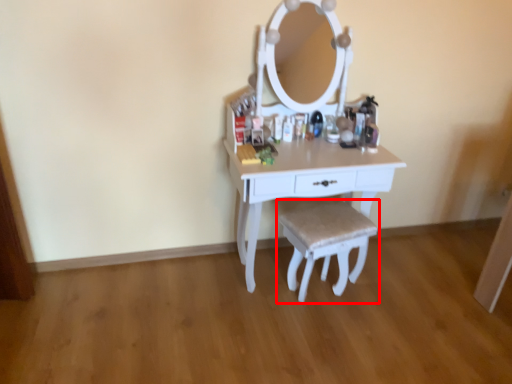
Question: Where is step stool (annotated by the red box) located in relation to table in the image?

Choices:
 (A) left
 (B) right

Answer: (B)